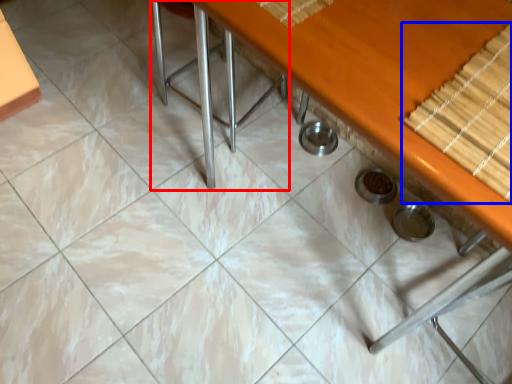
Question: Among these objects, which one is farthest to the camera, chair (highlighted by a red box) or wood (highlighted by a blue box)?

Choices:
 (A) chair
 (B) wood

Answer: (A)